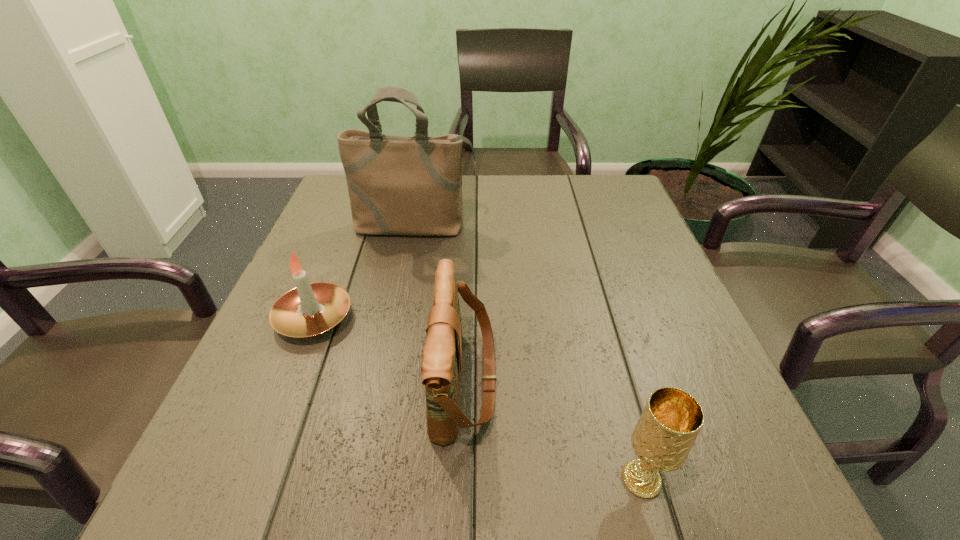
This screenshot has height=540, width=960. I want to click on free space between the rightmost object and the farther shoulder bag, so click(x=528, y=353).

What are the coordinates of `free space between the nearer shoulder bag and the rightmost object` in the screenshot? It's located at (553, 430).

Where is `free spot between the candle and the nearest object`? The image size is (960, 540). free spot between the candle and the nearest object is located at coordinates (478, 399).

Identify which object is located as the second nearest to the candle. Please provide its 2D coordinates. Your answer should be formatted as a tuple, i.e. [(x, y)], where the tuple contains the x and y coordinates of a point satisfying the conditions above.

[(397, 185)]

Find the location of a particular element. The image size is (960, 540). the second closest object to the candle is located at coordinates (397, 185).

At what (x,y) coordinates should I click in order to perform the action: click on free space that satisfies the following two spatial constraints: 1. on the front-facing side of the shorter shoulder bag; 2. on the back side of the chalice. Please return your answer as a coordinate pair (x, y). This screenshot has height=540, width=960. Looking at the image, I should click on (462, 480).

At what (x,y) coordinates should I click in order to perform the action: click on blank area in the image that satisfies the following two spatial constraints: 1. on the front side of the candle; 2. on the right side of the rightmost object. Please return your answer as a coordinate pair (x, y). Looking at the image, I should click on click(x=251, y=480).

I want to click on free space that satisfies the following two spatial constraints: 1. on the front-facing side of the nearer shoulder bag; 2. on the back side of the chalice, so click(x=462, y=480).